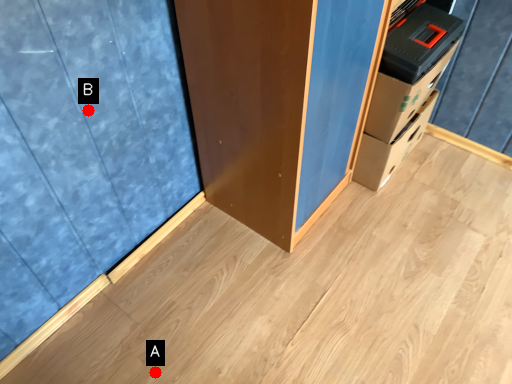
Question: Two points are circled on the image, labeled by A and B beside each circle. Which point appears closest to the camera in this image?

Choices:
 (A) A is closer
 (B) B is closer

Answer: (B)